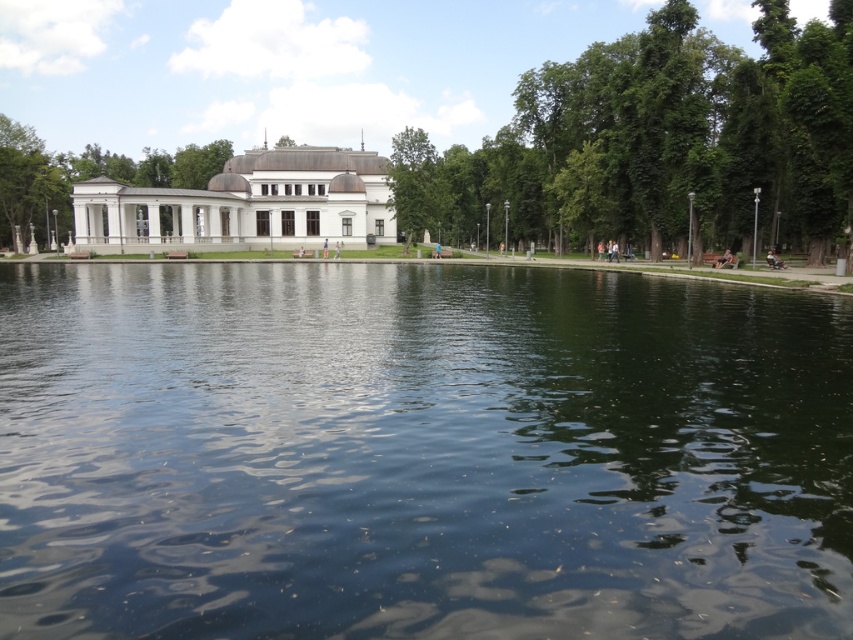
Question: Based on their relative distances, which object is farther from the green leafy tree at center?

Choices:
 (A) white stone pavilion at left
 (B) white glossy building at center

Answer: (A)

Question: Which point is farther to the camera?

Choices:
 (A) white stone pavilion at left
 (B) dark blue water at center
 (C) white glossy building at center
 (D) green leafy tree at center

Answer: (A)

Question: Among these objects, which one is nearest to the camera?

Choices:
 (A) white stone pavilion at left
 (B) dark blue water at center
 (C) white glossy building at center
 (D) green leafy tree at center

Answer: (B)

Question: Does dark blue water at center appear over white glossy building at center?

Choices:
 (A) no
 (B) yes

Answer: (A)

Question: Does white glossy building at center have a greater width compared to white stone pavilion at left?

Choices:
 (A) no
 (B) yes

Answer: (A)

Question: Can you confirm if dark blue water at center is positioned to the right of white stone pavilion at left?

Choices:
 (A) yes
 (B) no

Answer: (A)